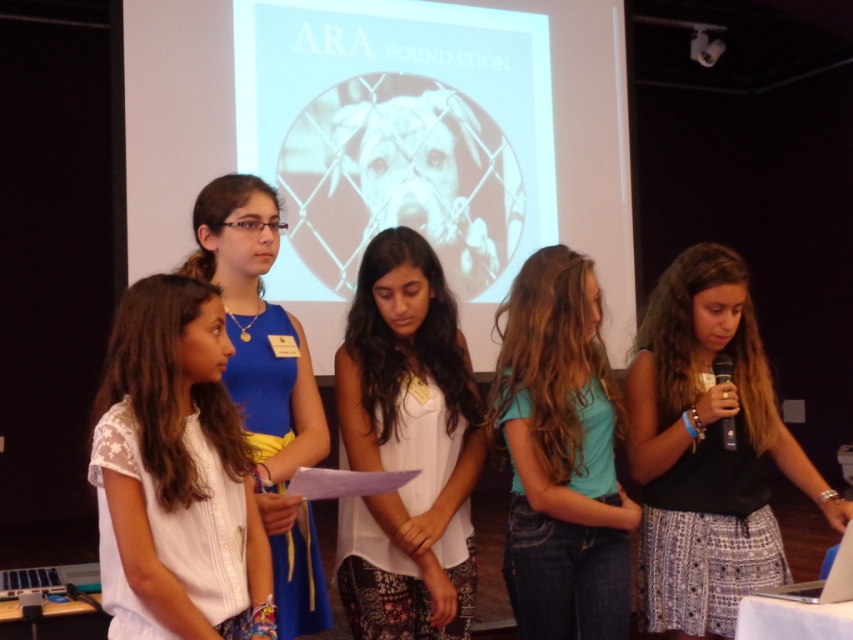
You are organizing a group photo and need to arrange the black cotton shirt at center and white fabric shirt at left in a row. Which one should you place first if you want the wider shirt to be on the right side?

Since the black cotton shirt at center is wider than the white fabric shirt at left, you should place the white fabric shirt at left first to have the wider shirt on the right side.

You are an event organizer and need to ensure that all participants have enough space to move comfortably. Given that the black cotton shirt at center and teal denim jeans at center are both at the center, which object takes up more horizontal space?

The black cotton shirt at center has a larger width than the teal denim jeans at center, so the black cotton shirt at center takes up more horizontal space.